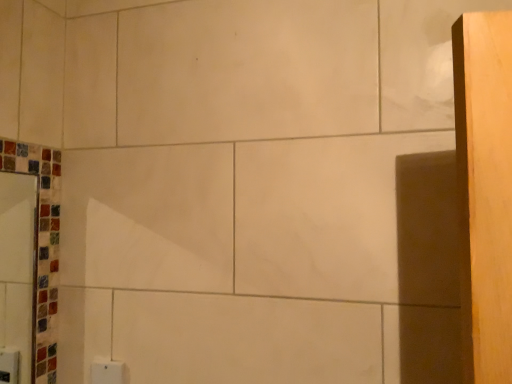
I want to click on white plastic outlet at lower left, so click(x=106, y=371).

Image resolution: width=512 pixels, height=384 pixels. What do you see at coordinates (106, 371) in the screenshot?
I see `white plastic outlet at lower left` at bounding box center [106, 371].

At what (x,y) coordinates should I click in order to perform the action: click on white plastic outlet at lower left. Please return your answer as a coordinate pair (x, y). Looking at the image, I should click on (106, 371).